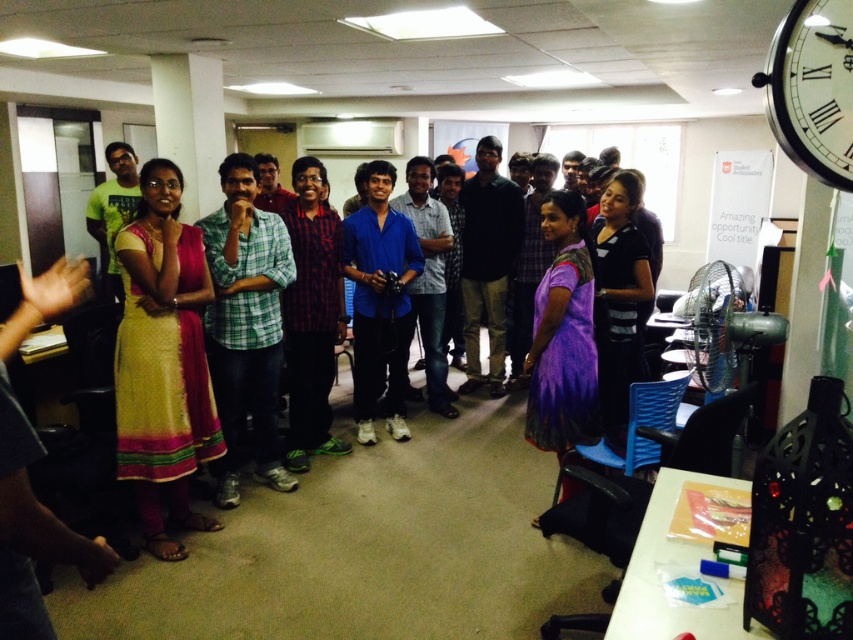
Between point (393, 458) and point (799, 58), which one is positioned in front?

Point (799, 58) is in front.

Measure the distance between matte yellow dress at center and camera.

The distance of matte yellow dress at center from camera is 7.80 feet.

Image resolution: width=853 pixels, height=640 pixels. In order to click on matte yellow dress at center in this screenshot , I will do `click(366, 545)`.

What do you see at coordinates (245, 324) in the screenshot? I see `green plaid shirt at center` at bounding box center [245, 324].

Is green plaid shirt at center wider than blue matte shirt at center?

Yes.

You are a GUI agent. You are given a task and a screenshot of the screen. Output one action in this format:
    pyautogui.click(x=<x>, y=<y>)
    Task: Click on the green plaid shirt at center
    This screenshot has height=640, width=853.
    Given the screenshot: What is the action you would take?
    pos(245,324)

The height and width of the screenshot is (640, 853). Identify the location of green plaid shirt at center. (245, 324).

Between point (339, 461) and point (224, 465), which one is positioned behind?

Point (339, 461)

Between point (375, 563) and point (248, 308), which one is positioned in front?

Positioned in front is point (375, 563).

At what (x,y) coordinates should I click in order to perform the action: click on matte yellow dress at center. Please return your answer as a coordinate pair (x, y). Looking at the image, I should click on (366, 545).